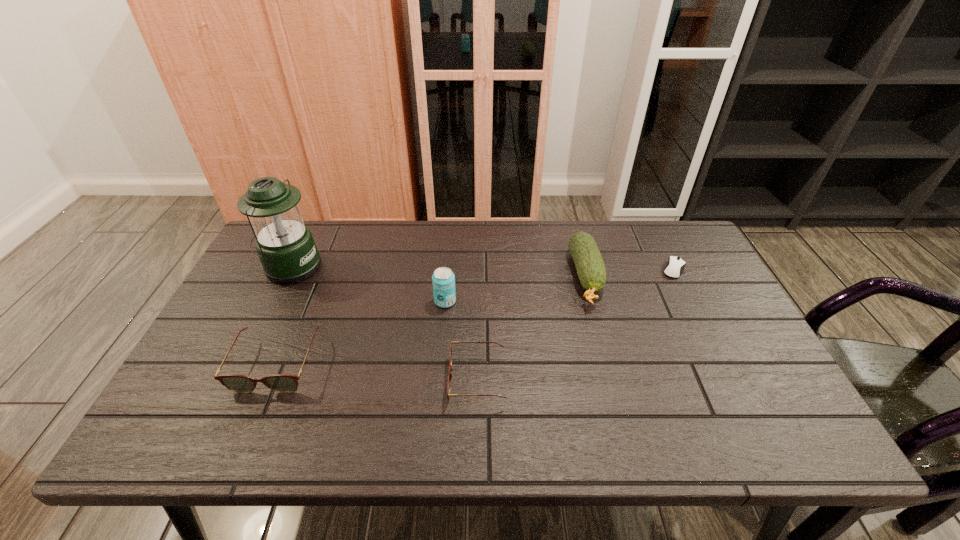
Locate an element on the screen. The width and height of the screenshot is (960, 540). spectacles located at the left edge is located at coordinates (282, 383).

The image size is (960, 540). Find the location of `lantern located in the left edge section of the desktop`. lantern located in the left edge section of the desktop is located at coordinates (285, 245).

What are the coordinates of `object positioned at the right edge` in the screenshot? It's located at (675, 266).

This screenshot has width=960, height=540. I want to click on object present at the far left corner, so click(285, 245).

Find the location of a particular element. object present at the near left corner is located at coordinates (282, 383).

Locate an element on the screen. The image size is (960, 540). object that is at the far right corner is located at coordinates (675, 266).

This screenshot has height=540, width=960. I want to click on free spot at the far edge of the desktop, so click(x=330, y=235).

Where is `vacant area at the near edge`? This screenshot has width=960, height=540. vacant area at the near edge is located at coordinates (410, 410).

This screenshot has height=540, width=960. In the image, there is a desktop. What are the coordinates of `free region at the left edge` in the screenshot? It's located at (248, 313).

Identify the location of vacant space at the right edge of the desktop. (681, 307).